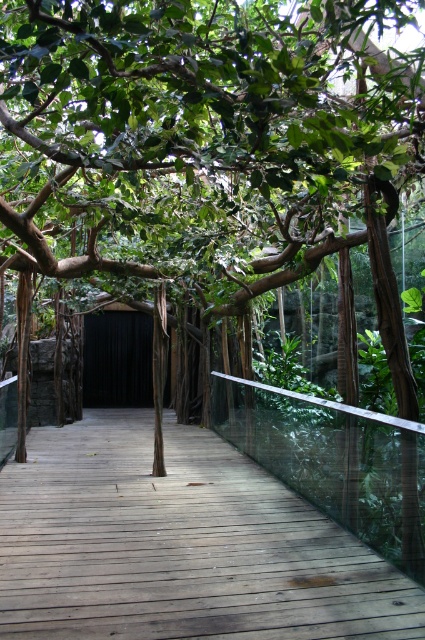
Which is more to the left, green leafy tree at center or brown wooden path at center?

brown wooden path at center is more to the left.

Can you confirm if green leafy tree at center is wider than brown wooden path at center?

Correct, the width of green leafy tree at center exceeds that of brown wooden path at center.

Does point (320, 81) come farther from viewer compared to point (23, 497)?

No, (320, 81) is in front of (23, 497).

Image resolution: width=425 pixels, height=640 pixels. I want to click on green leafy tree at center, so click(x=200, y=138).